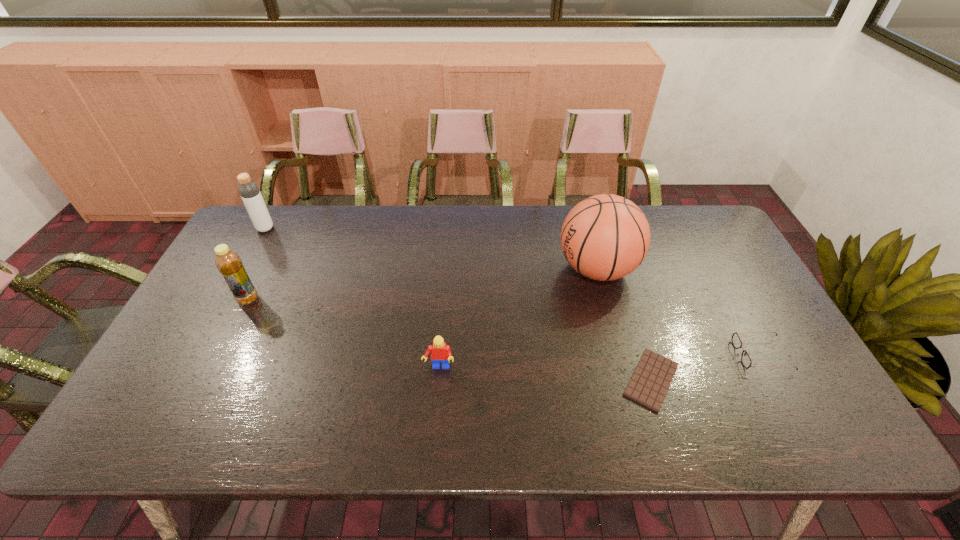
Image resolution: width=960 pixels, height=540 pixels. Find the location of `vacant point located 0.140m on the surface of the tallest object near the brand logo`. vacant point located 0.140m on the surface of the tallest object near the brand logo is located at coordinates (511, 269).

Locate an element on the screen. Image resolution: width=960 pixels, height=540 pixels. vacant point located 0.250m on the surface of the tallest object near the brand logo is located at coordinates (475, 269).

Locate an element on the screen. The width and height of the screenshot is (960, 540). vacant area located 0.270m on the surface of the tallest object near the brand logo is located at coordinates (468, 269).

Where is `free space located on the back of the leftmost object`? free space located on the back of the leftmost object is located at coordinates (275, 211).

This screenshot has width=960, height=540. Identify the location of blank area located 0.260m on the right of the fifth object from right to left. (349, 299).

Where is `free space located on the front-facing side of the Lego`? The image size is (960, 540). free space located on the front-facing side of the Lego is located at coordinates (435, 415).

Image resolution: width=960 pixels, height=540 pixels. Identify the location of free region located on the front-facing side of the second shortest object. (583, 355).

The image size is (960, 540). Find the location of `free spot located on the front-facing side of the second shortest object`. free spot located on the front-facing side of the second shortest object is located at coordinates (714, 355).

The height and width of the screenshot is (540, 960). In order to click on free location located on the front-facing side of the second shortest object in this screenshot , I will do `click(672, 355)`.

Image resolution: width=960 pixels, height=540 pixels. What are the coordinates of `free spot located 0.270m on the left of the shortest object` in the screenshot? It's located at pyautogui.click(x=510, y=380).